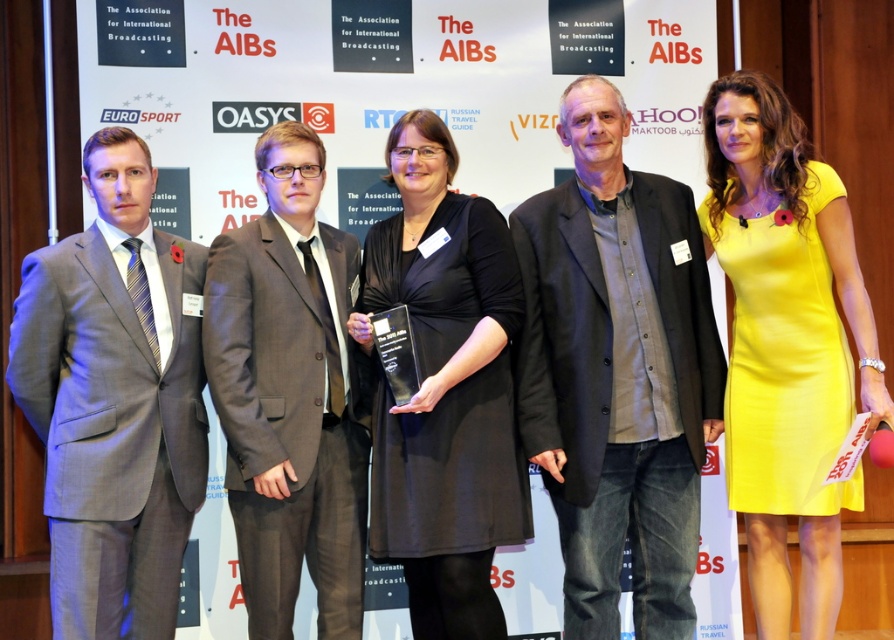
Is dark gray button-up shirt at center wider than gray suit at left?

Correct, the width of dark gray button-up shirt at center exceeds that of gray suit at left.

Which is behind, point (544, 196) or point (10, 381)?

Positioned behind is point (544, 196).

Where is `dark gray button-up shirt at center`? The image size is (894, 640). dark gray button-up shirt at center is located at coordinates (617, 371).

How far apart are dark gray suit at center and black matte dress at center?

dark gray suit at center and black matte dress at center are 11.15 inches apart.

What are the coordinates of `dark gray suit at center` in the screenshot? It's located at (291, 394).

Who is positioned more to the left, gray suit at left or dark gray suit at center?

gray suit at left is more to the left.

Which is above, gray suit at left or dark gray suit at center?

dark gray suit at center is higher up.

Does point (203, 250) lie in front of point (329, 600)?

No, it is behind (329, 600).

The height and width of the screenshot is (640, 894). In order to click on gray suit at left in this screenshot , I will do `click(114, 401)`.